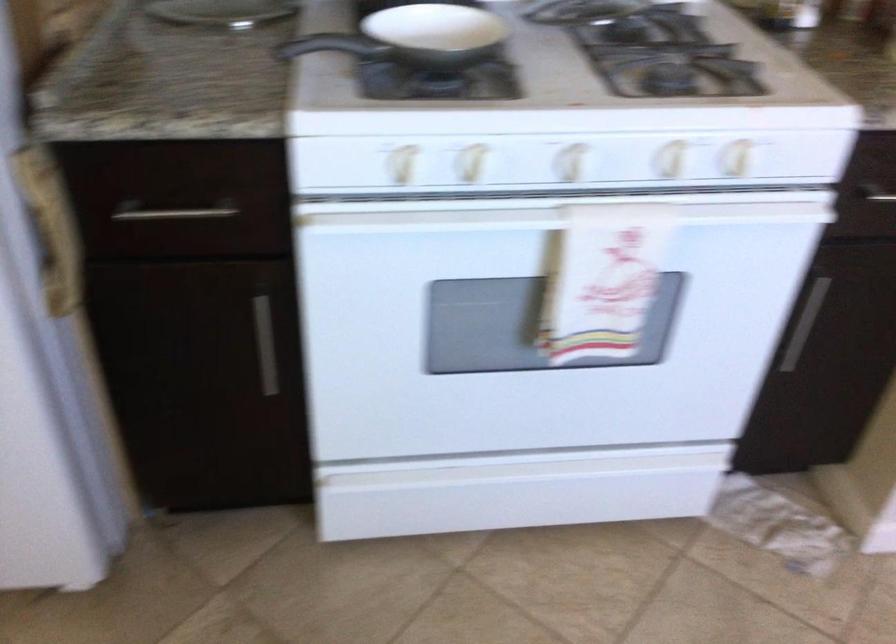
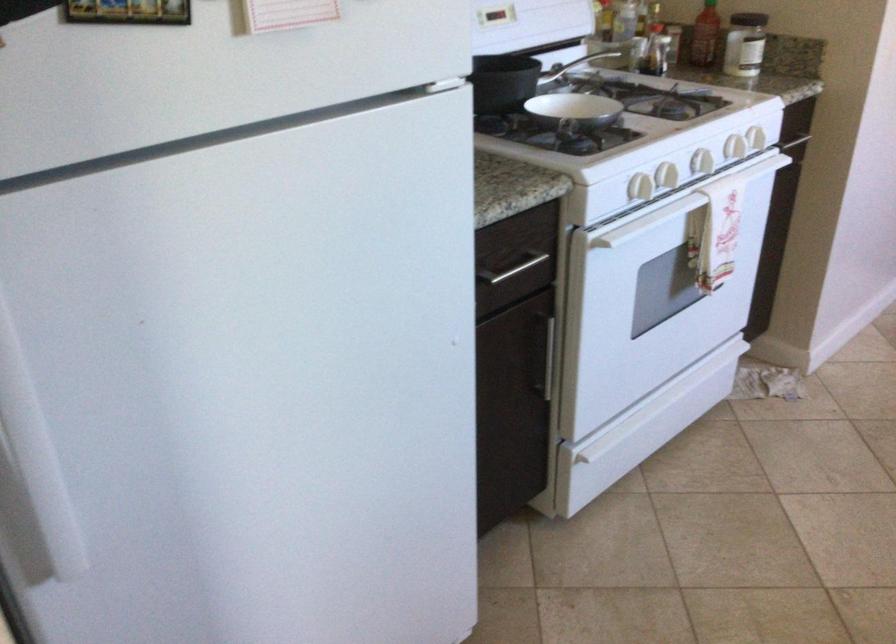
The point at (225, 372) is marked in the first image. Where is the corresponding point in the second image?

(549, 359)